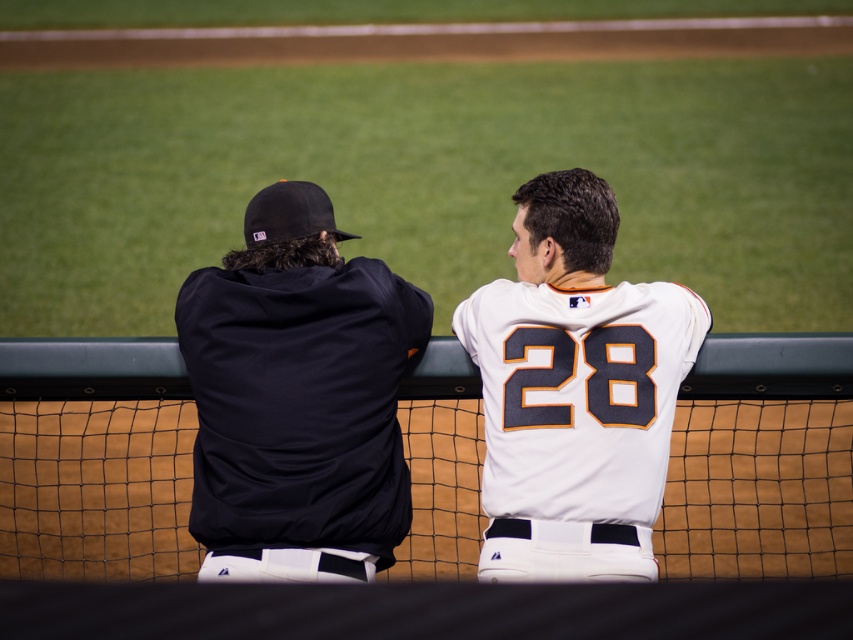
From the picture: You are a photographer positioned behind the two individuals. You want to take a photo that includes both the dark blue jersey at left and the white jersey at center. Which direction should you move to ensure both are framed properly?

You should move to the right to include both the dark blue jersey at left and the white jersey at center in the frame since the dark blue jersey at left is to the left of the white jersey at center.